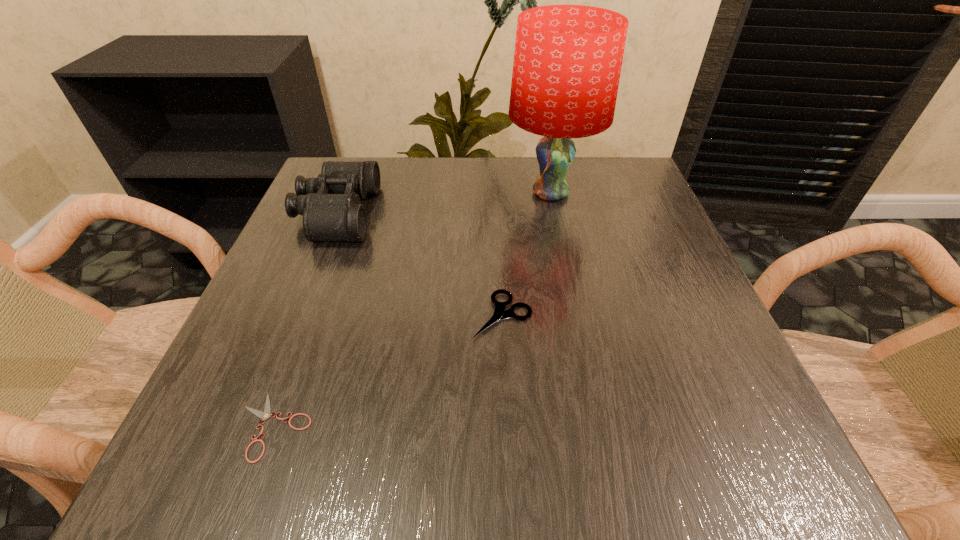
Find the location of `vacant region that satisfies the following two spatial constraints: 1. at the eyepieces of the second tallest object; 2. on the left side of the second shortest object`. vacant region that satisfies the following two spatial constraints: 1. at the eyepieces of the second tallest object; 2. on the left side of the second shortest object is located at coordinates (297, 315).

Find the location of a particular element. This screenshot has height=540, width=960. vacant area in the image that satisfies the following two spatial constraints: 1. at the eyepieces of the binoculars; 2. on the left side of the shortest object is located at coordinates (253, 426).

Where is `vacant space that satisfies the following two spatial constraints: 1. at the eyepieces of the third farthest object; 2. on the left side of the binoculars`? This screenshot has height=540, width=960. vacant space that satisfies the following two spatial constraints: 1. at the eyepieces of the third farthest object; 2. on the left side of the binoculars is located at coordinates (297, 315).

Find the location of a particular element. This screenshot has height=540, width=960. vacant space that satisfies the following two spatial constraints: 1. at the eyepieces of the left shears; 2. on the left side of the second tallest object is located at coordinates (253, 426).

Where is `vacant area that satisfies the following two spatial constraints: 1. on the front-facing side of the tallest object; 2. at the eyepieces of the binoculars`? vacant area that satisfies the following two spatial constraints: 1. on the front-facing side of the tallest object; 2. at the eyepieces of the binoculars is located at coordinates (555, 213).